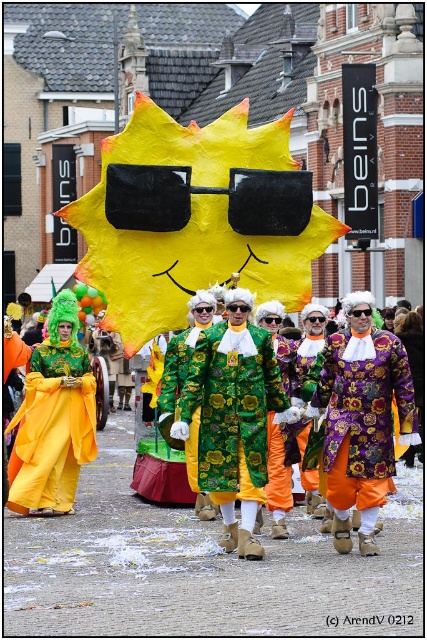
Question: Observing the image, what is the correct spatial positioning of green floral fabric coat at center in reference to purple velvet coat at center?

Choices:
 (A) above
 (B) below

Answer: (B)

Question: Which of these objects is positioned closest to the matte yellow dress at center?

Choices:
 (A) yellow paper/mask at center
 (B) green floral fabric coat at center
 (C) purple velvet coat at center

Answer: (A)

Question: Is green floral fabric coat at center positioned at the back of matte yellow dress at center?

Choices:
 (A) yes
 (B) no

Answer: (B)

Question: Which of the following is the closest to the observer?

Choices:
 (A) (392, 371)
 (B) (228, 189)
 (C) (240, 305)

Answer: (A)

Question: Is purple velvet coat at center to the left of matte yellow dress at center from the viewer's perspective?

Choices:
 (A) no
 (B) yes

Answer: (A)

Question: Which point is closer to the camera?

Choices:
 (A) green floral fabric coat at center
 (B) purple velvet coat at center

Answer: (B)